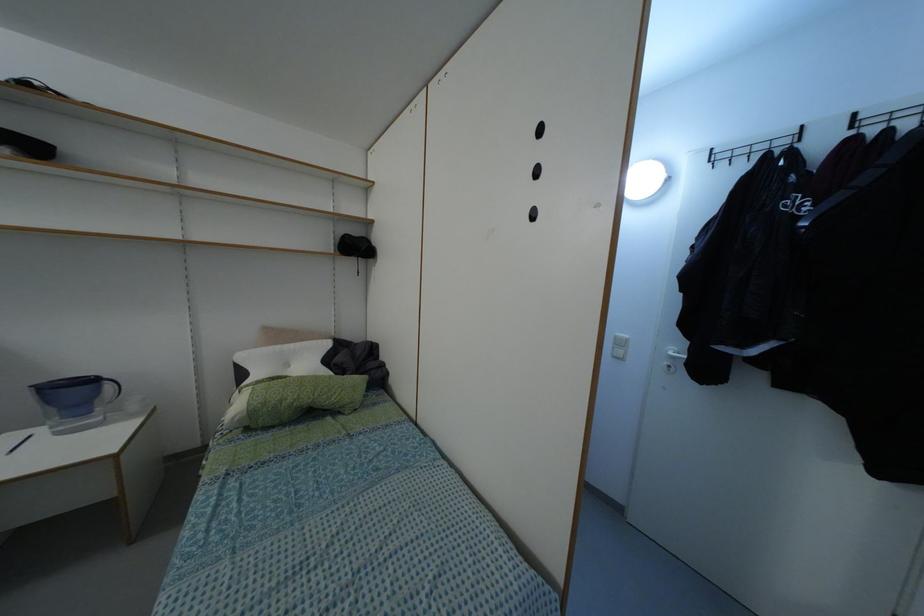
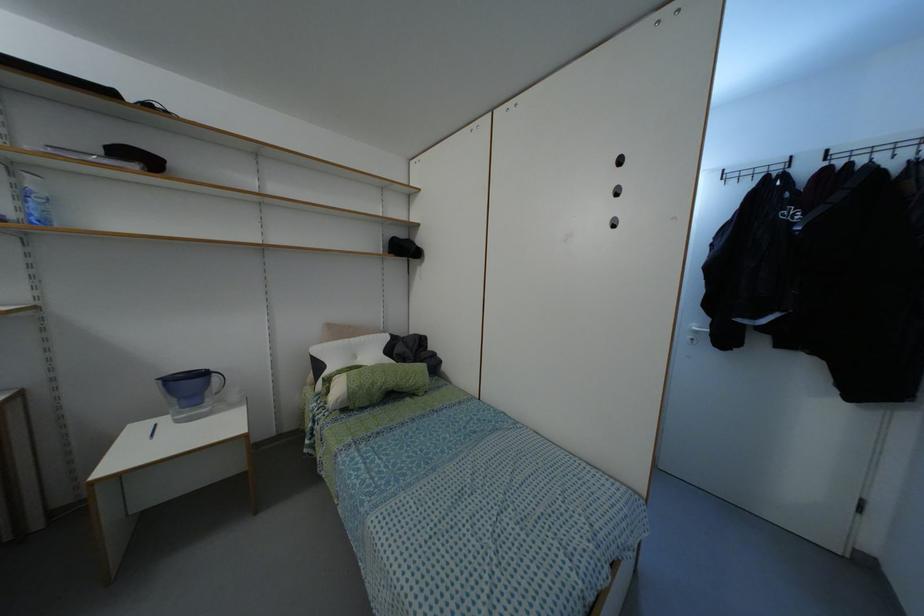
The point at [675,347] is marked in the first image. Where is the corresponding point in the second image?

(698, 323)